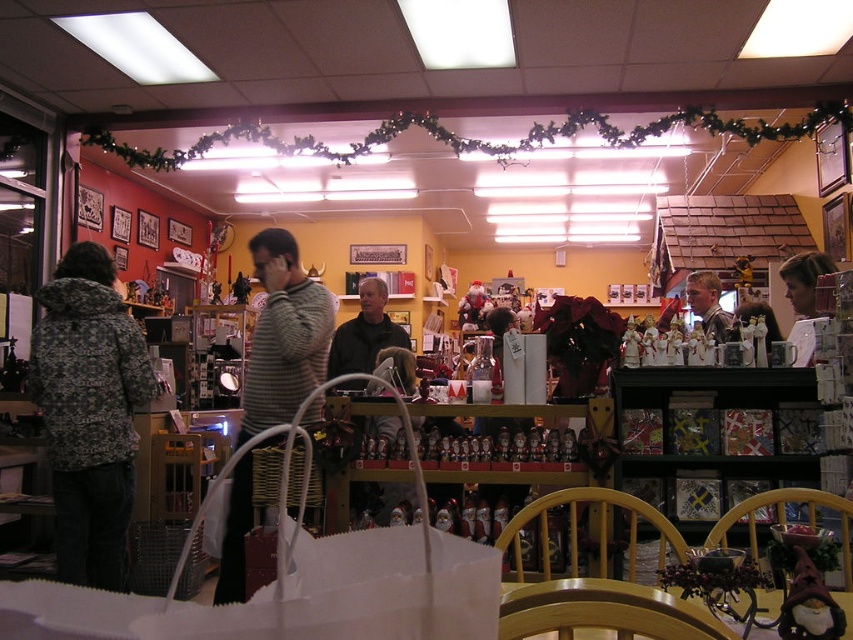
Does striped sweater at center appear on the right side of smooth gray sweater at center?

Incorrect, striped sweater at center is not on the right side of smooth gray sweater at center.

Does striped sweater at center have a larger size compared to smooth gray sweater at center?

Yes, striped sweater at center is bigger than smooth gray sweater at center.

The width and height of the screenshot is (853, 640). Describe the element at coordinates (283, 336) in the screenshot. I see `striped sweater at center` at that location.

Identify the location of striped sweater at center. This screenshot has width=853, height=640. (283, 336).

Who is more forward, (287, 390) or (373, 317)?

Positioned in front is point (287, 390).

Is point (252, 333) farther from viewer compared to point (372, 365)?

That is True.

The width and height of the screenshot is (853, 640). I want to click on striped sweater at center, so click(x=283, y=336).

Is patterned fabric jacket at left smaller than smooth gray sweater at center?

Indeed, patterned fabric jacket at left has a smaller size compared to smooth gray sweater at center.

Is patterned fabric jacket at left wider than smooth gray sweater at center?

Yes, patterned fabric jacket at left is wider than smooth gray sweater at center.

The width and height of the screenshot is (853, 640). I want to click on patterned fabric jacket at left, so click(90, 412).